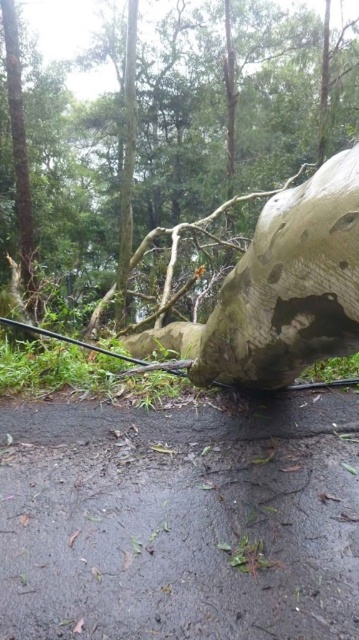
Question: Considering the relative positions of greenish-brown rough bark stump at center and green rough bark at left in the image provided, where is greenish-brown rough bark stump at center located with respect to green rough bark at left?

Choices:
 (A) right
 (B) left

Answer: (A)

Question: Which object appears closest to the camera in this image?

Choices:
 (A) green rough bark tree at center
 (B) greenish-brown rough bark stump at center

Answer: (B)

Question: Estimate the real-world distances between objects in this image. Which object is farther from the green rough bark tree at center?

Choices:
 (A) green rough bark at left
 (B) greenish-brown rough bark stump at center

Answer: (B)

Question: Is green rough bark tree at center to the right of greenish-brown rough bark stump at center from the viewer's perspective?

Choices:
 (A) no
 (B) yes

Answer: (A)

Question: Which object is closer to the camera taking this photo?

Choices:
 (A) green rough bark at left
 (B) green rough bark tree at center

Answer: (B)

Question: Is greenish-brown rough bark stump at center in front of green rough bark at left?

Choices:
 (A) no
 (B) yes

Answer: (B)